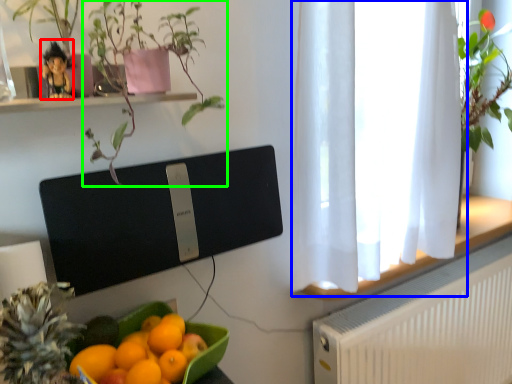
Question: Considering the real-world distances, which object is farthest from toy (highlighted by a red box)? window frame (highlighted by a blue box) or houseplant (highlighted by a green box)?

Choices:
 (A) window frame
 (B) houseplant

Answer: (A)